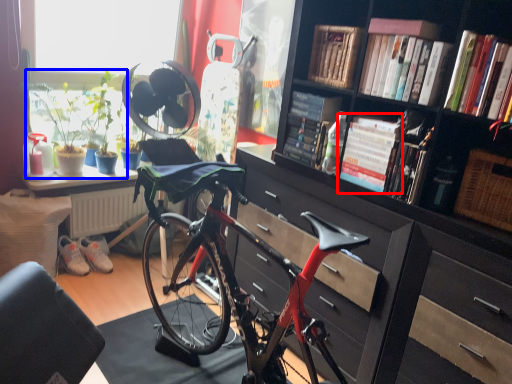
Question: Which object is closer to the camera taking this photo, book (highlighted by a red box) or houseplant (highlighted by a blue box)?

Choices:
 (A) book
 (B) houseplant

Answer: (A)